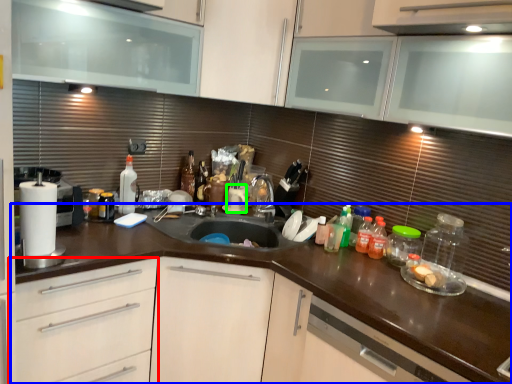
Question: Estimate the real-world distances between objects in this image. Which object is farther from drawer (highlighted by a red box), countertop (highlighted by a blue box) or appliance (highlighted by a green box)?

Choices:
 (A) countertop
 (B) appliance

Answer: (B)